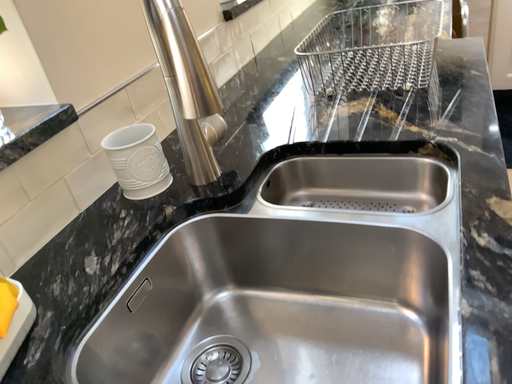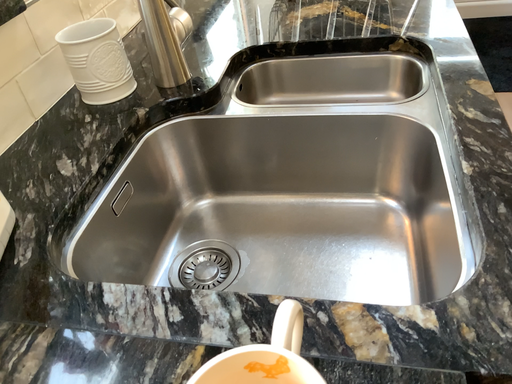
Question: How did the camera likely rotate when shooting the video?

Choices:
 (A) rotated right
 (B) rotated left

Answer: (A)